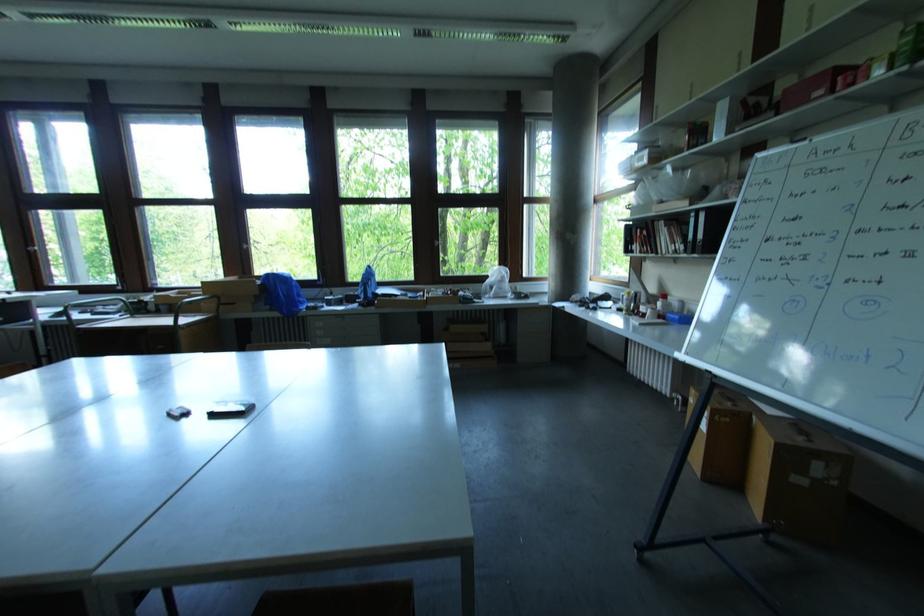
The location [229,408] corresponds to which object?

This point indicates the black smartphone.